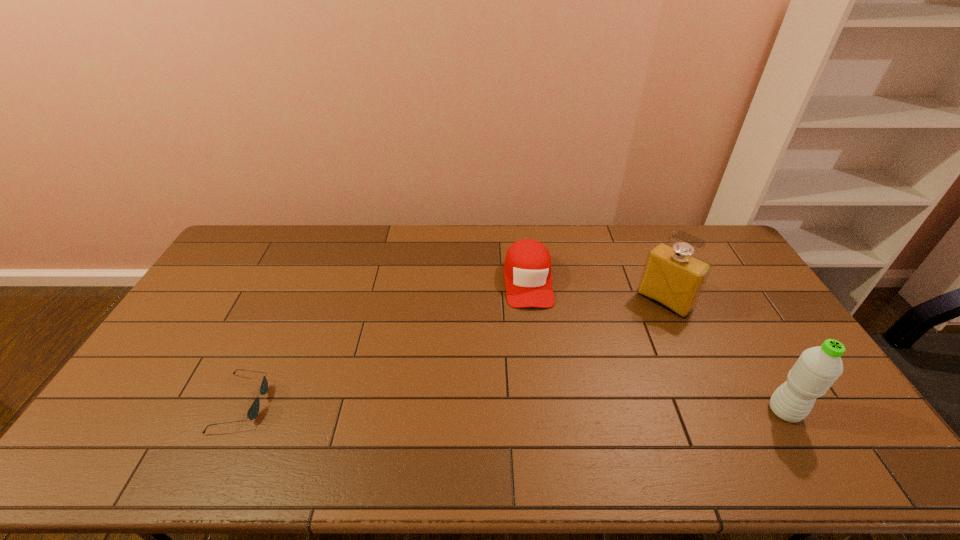
Find the location of a particular element. free point between the shortest object and the baseball cap is located at coordinates coord(385,342).

Locate an element on the screen. free space between the rightmost object and the baseball cap is located at coordinates (657, 346).

This screenshot has width=960, height=540. In order to click on vacant area that lies between the rightmost object and the baseball cap in this screenshot , I will do `click(657, 346)`.

Identify the location of object identified as the second closest to the sunglasses. This screenshot has width=960, height=540. (673, 278).

Identify which object is located as the nearest to the leftmost object. Please provide its 2D coordinates. Your answer should be formatted as a tuple, i.e. [(x, y)], where the tuple contains the x and y coordinates of a point satisfying the conditions above.

[(527, 271)]

Find the location of a particular element. free space that satisfies the following two spatial constraints: 1. on the front side of the third object from right to left; 2. on the right side of the rightmost object is located at coordinates (544, 411).